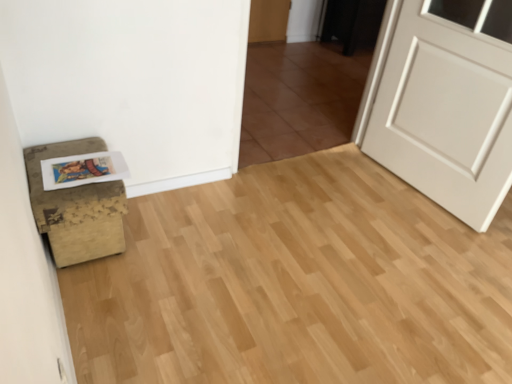
Question: Is distressed brown ottoman at lower left far from matte paper postcard at lower left?

Choices:
 (A) no
 (B) yes

Answer: (A)

Question: From a real-world perspective, is distressed brown ottoman at lower left located beneath matte paper postcard at lower left?

Choices:
 (A) no
 (B) yes

Answer: (B)

Question: Could you tell me if distressed brown ottoman at lower left is turned towards matte paper postcard at lower left?

Choices:
 (A) no
 (B) yes

Answer: (A)

Question: Is distressed brown ottoman at lower left placed right next to matte paper postcard at lower left?

Choices:
 (A) yes
 (B) no

Answer: (B)

Question: Is distressed brown ottoman at lower left taller than matte paper postcard at lower left?

Choices:
 (A) yes
 (B) no

Answer: (A)

Question: From a real-world perspective, is brown tile at center positioned above or below distressed brown ottoman at lower left?

Choices:
 (A) below
 (B) above

Answer: (B)

Question: Is brown tile at center wider or thinner than distressed brown ottoman at lower left?

Choices:
 (A) wide
 (B) thin

Answer: (B)

Question: Looking at the image, does brown tile at center seem bigger or smaller compared to distressed brown ottoman at lower left?

Choices:
 (A) small
 (B) big

Answer: (B)

Question: In terms of height, does brown tile at center look taller or shorter compared to distressed brown ottoman at lower left?

Choices:
 (A) short
 (B) tall

Answer: (B)

Question: In terms of width, does brown tile at center look wider or thinner when compared to white matte door at right?

Choices:
 (A) thin
 (B) wide

Answer: (A)

Question: Is brown tile at center inside or outside of white matte door at right?

Choices:
 (A) inside
 (B) outside

Answer: (B)

Question: Considering the positions of brown tile at center and white matte door at right in the image, is brown tile at center taller or shorter than white matte door at right?

Choices:
 (A) short
 (B) tall

Answer: (A)

Question: In terms of size, does brown tile at center appear bigger or smaller than white matte door at right?

Choices:
 (A) small
 (B) big

Answer: (A)

Question: Is matte paper postcard at lower left in front of or behind brown tile at center in the image?

Choices:
 (A) behind
 (B) front

Answer: (B)

Question: Would you say matte paper postcard at lower left is inside or outside brown tile at center?

Choices:
 (A) outside
 (B) inside

Answer: (A)